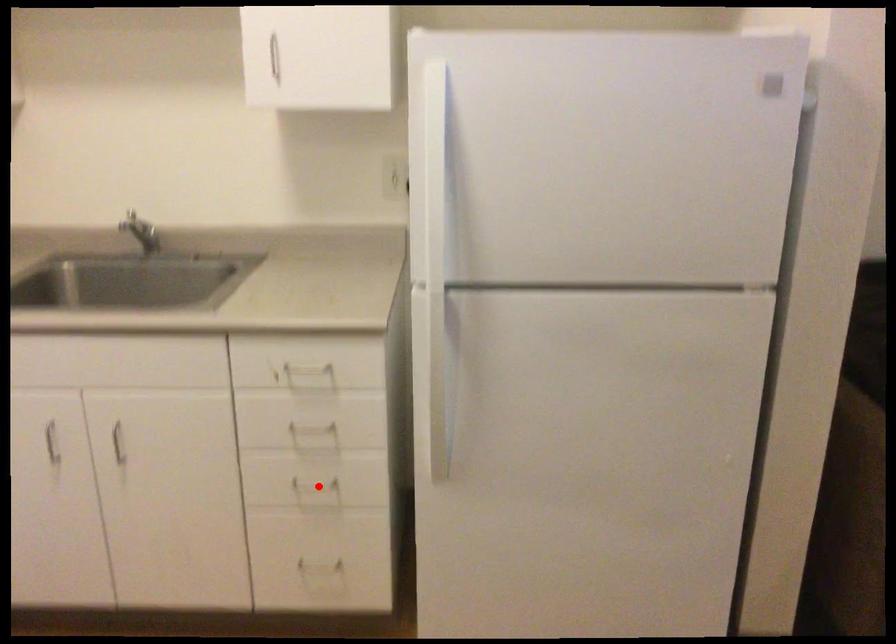
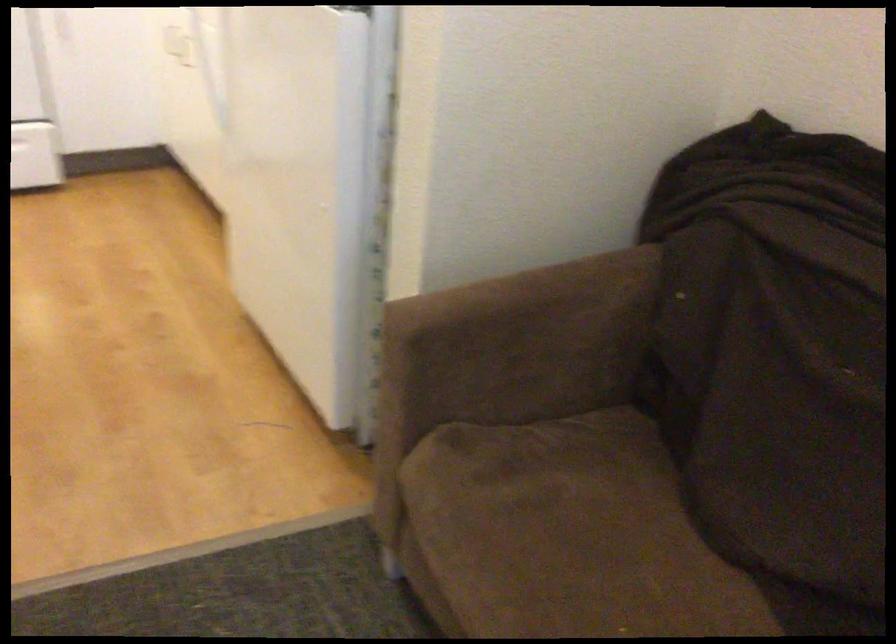
Question: I am providing you with two images of the same scene from different viewpoints. A red point is marked on the first image. At the location where the point appears in image 1, is it still visible in image 2?

Choices:
 (A) Yes
 (B) No

Answer: (B)